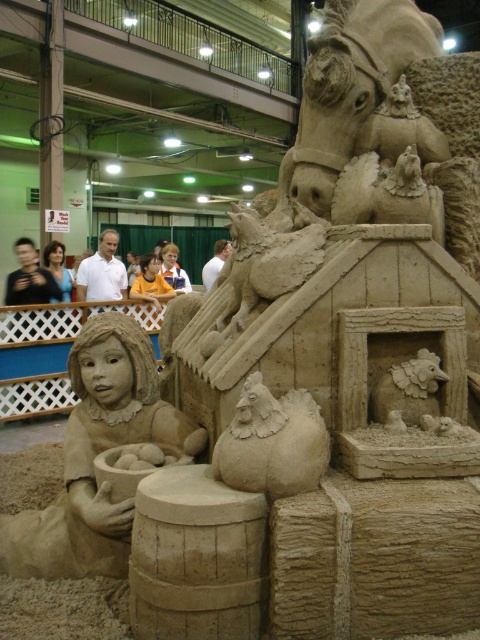
You are a GUI agent. You are given a task and a screenshot of the screen. Output one action in this format:
    pyautogui.click(x=<x>, y=<y>)
    Task: Click on the smooth sand girl at lower left
    
    Given the screenshot: What is the action you would take?
    pyautogui.click(x=96, y=454)

Measure the distance between point (84, 428) and camera.

They are 4.95 meters apart.

Does point (105, 419) come behind point (117, 280)?

That is False.

Where is `smooth sand girl at lower left`? smooth sand girl at lower left is located at coordinates (96, 454).

Can you confirm if smooth sand girl at lower left is taller than matte black shirt at left?

Indeed, smooth sand girl at lower left has a greater height compared to matte black shirt at left.

Does smooth sand girl at lower left appear on the right side of matte black shirt at left?

Indeed, smooth sand girl at lower left is positioned on the right side of matte black shirt at left.

Which is in front, point (144, 426) or point (43, 301)?

Point (144, 426) is more forward.

You are a GUI agent. You are given a task and a screenshot of the screen. Output one action in this format:
    pyautogui.click(x=<x>, y=<y>)
    Task: Click on the smooth sand girl at lower left
    Image resolution: width=480 pixels, height=640 pixels.
    Given the screenshot: What is the action you would take?
    pyautogui.click(x=96, y=454)

Is matte black shirt at left further to the viewer compared to yellow shirt at center?

No, matte black shirt at left is closer to the viewer.

Is matte black shirt at left above yellow shirt at center?

No.

Who is more forward, (x=46, y=278) or (x=158, y=307)?

Point (x=46, y=278)

Where is `matte black shirt at left`? Image resolution: width=480 pixels, height=640 pixels. matte black shirt at left is located at coordinates (29, 278).